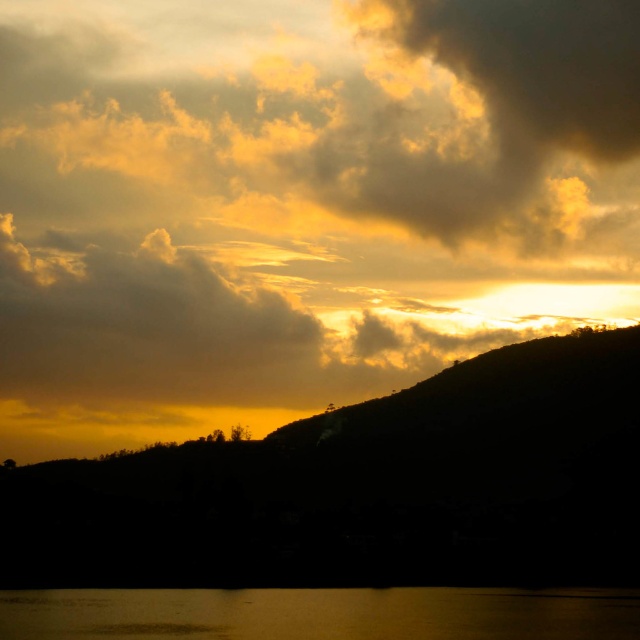
Which is in front, point (355, 472) or point (49, 611)?

Positioned in front is point (355, 472).

Is silhouette mountain at center below silvery reflective water at lower center?

Actually, silhouette mountain at center is above silvery reflective water at lower center.

Is point (556, 582) behind point (113, 627)?

Yes, point (556, 582) is behind point (113, 627).

This screenshot has height=640, width=640. I want to click on silhouette mountain at center, so click(x=365, y=488).

Image resolution: width=640 pixels, height=640 pixels. Describe the element at coordinates (298, 202) in the screenshot. I see `golden matte cloud at upper center` at that location.

Does golden matte cloud at upper center have a lesser width compared to silvery reflective water at lower center?

In fact, golden matte cloud at upper center might be wider than silvery reflective water at lower center.

At what (x,y) coordinates should I click in order to perform the action: click on golden matte cloud at upper center. Please return your answer as a coordinate pair (x, y). Looking at the image, I should click on (298, 202).

At what (x,y) coordinates should I click in order to perform the action: click on golden matte cloud at upper center. Please return your answer as a coordinate pair (x, y). Looking at the image, I should click on (298, 202).

Can you confirm if golden matte cloud at upper center is smaller than silhouette mountain at center?

Actually, golden matte cloud at upper center might be larger than silhouette mountain at center.

Is golden matte cloud at upper center thinner than silhouette mountain at center?

In fact, golden matte cloud at upper center might be wider than silhouette mountain at center.

Does point (396, 157) come behind point (438, 408)?

Yes, it is behind point (438, 408).

You are a GUI agent. You are given a task and a screenshot of the screen. Output one action in this format:
    pyautogui.click(x=<x>, y=<y>)
    Task: Click on the golden matte cloud at upper center
    The width and height of the screenshot is (640, 640).
    Given the screenshot: What is the action you would take?
    point(298,202)